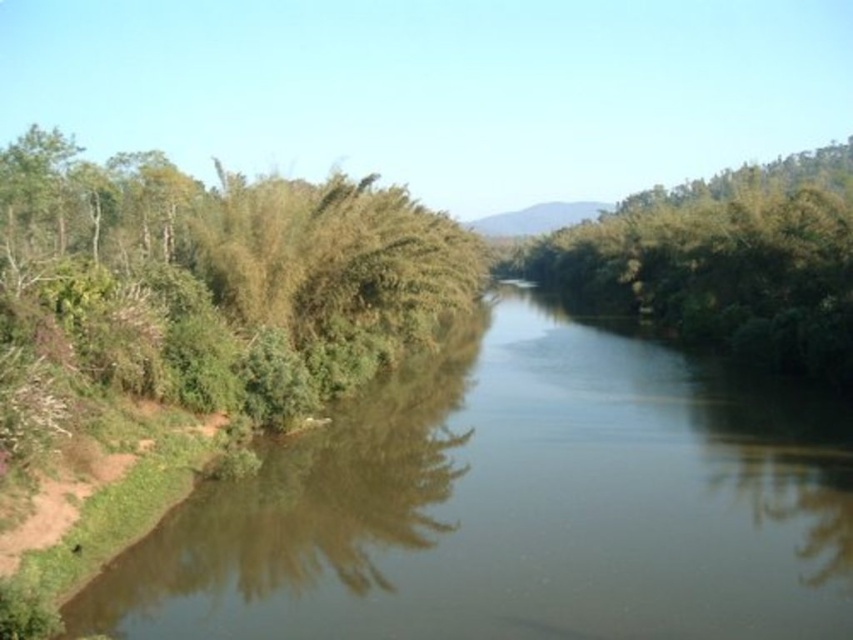
Who is positioned more to the right, green leafy river at left or green leafy trees at center?

green leafy trees at center is more to the right.

Does green leafy river at left appear on the right side of green leafy trees at center?

Incorrect, green leafy river at left is not on the right side of green leafy trees at center.

Is point (218, 516) positioned before point (836, 253)?

Yes, point (218, 516) is closer to viewer.

In order to click on green leafy river at left in this screenshot , I will do `click(517, 502)`.